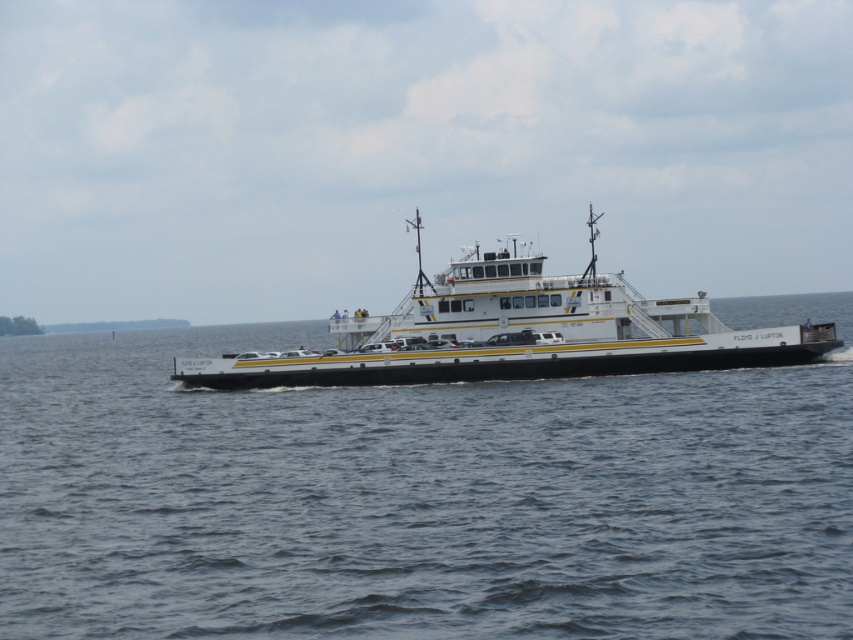
Question: Which point appears closest to the camera in this image?

Choices:
 (A) (610, 608)
 (B) (634, 328)

Answer: (A)

Question: Is black water at center to the right of white/yellow painted ferry at center from the viewer's perspective?

Choices:
 (A) yes
 (B) no

Answer: (B)

Question: Which point appears farthest from the camera in this image?

Choices:
 (A) (660, 365)
 (B) (73, 636)

Answer: (A)

Question: Can you confirm if black water at center is positioned to the left of white/yellow painted ferry at center?

Choices:
 (A) yes
 (B) no

Answer: (A)

Question: Can you confirm if black water at center is positioned above white/yellow painted ferry at center?

Choices:
 (A) no
 (B) yes

Answer: (A)